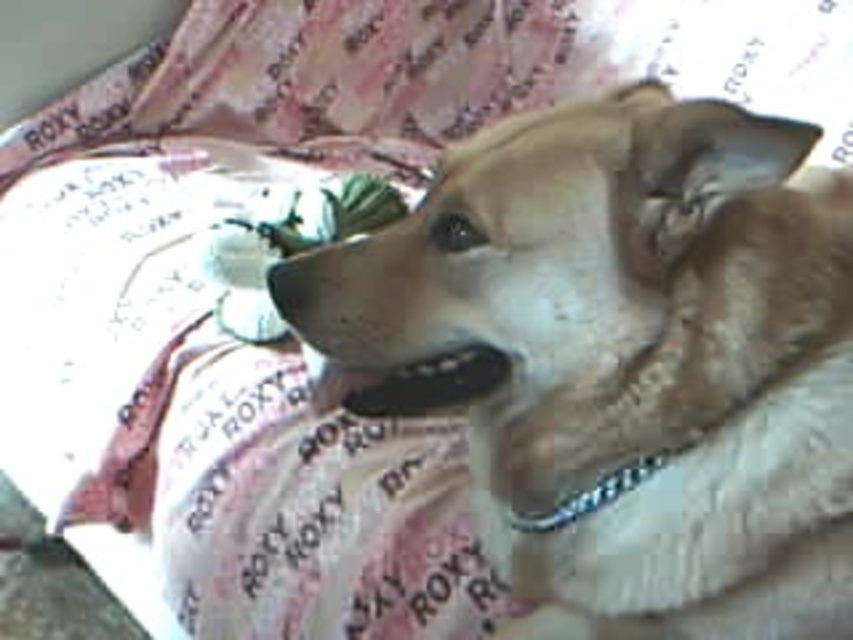
Does green fabric flower at center appear on the right side of metallic chain at center?

Incorrect, green fabric flower at center is not on the right side of metallic chain at center.

Can you confirm if green fabric flower at center is shorter than metallic chain at center?

In fact, green fabric flower at center may be taller than metallic chain at center.

Does point (248, 228) come farther from viewer compared to point (585, 512)?

Yes, point (248, 228) is farther from viewer.

At what (x,y) coordinates should I click in order to perform the action: click on green fabric flower at center. Please return your answer as a coordinate pair (x, y). The image size is (853, 640). Looking at the image, I should click on (289, 244).

Between light brown fur at center and green fabric flower at center, which one has less height?

With less height is green fabric flower at center.

Does light brown fur at center appear on the left side of green fabric flower at center?

Incorrect, light brown fur at center is not on the left side of green fabric flower at center.

Find the location of `light brown fur at center`. light brown fur at center is located at coordinates (622, 360).

Based on the photo, is light brown fur at center to the right of metallic chain at center from the viewer's perspective?

Incorrect, light brown fur at center is not on the right side of metallic chain at center.

Which is more to the right, light brown fur at center or metallic chain at center?

metallic chain at center

Does point (447, 205) come farther from viewer compared to point (610, 493)?

No, it is not.

The image size is (853, 640). In order to click on light brown fur at center in this screenshot , I will do `click(622, 360)`.